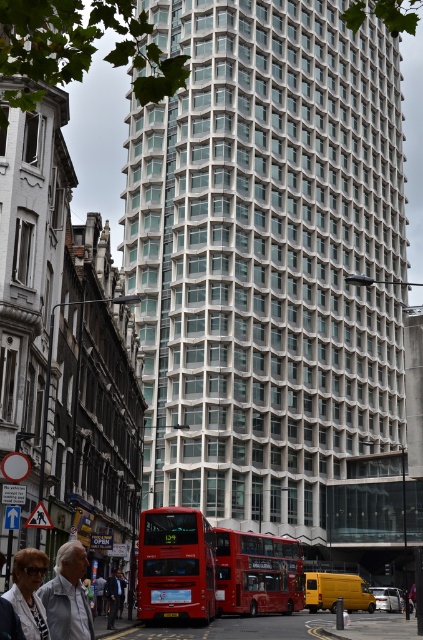
Question: In this image, where is red matte double-decker bus at center located relative to white fabric jacket at lower left?

Choices:
 (A) below
 (B) above

Answer: (A)

Question: Is matte red bus at center wider than white fabric jacket at lower left?

Choices:
 (A) no
 (B) yes

Answer: (B)

Question: Does red matte double-decker bus at center appear on the left side of white fabric jacket at lower left?

Choices:
 (A) yes
 (B) no

Answer: (B)

Question: Which object is farther from the camera taking this photo?

Choices:
 (A) red matte double-decker bus at center
 (B) matte red bus at center
 (C) white fabric jacket at lower left
 (D) matte black jacket at lower left

Answer: (B)

Question: Which object appears farthest from the camera in this image?

Choices:
 (A) matte black jacket at lower left
 (B) red matte double-decker bus at center
 (C) matte red bus at center
 (D) white fabric jacket at lower left

Answer: (C)

Question: Which point appears closest to the camera in this image?

Choices:
 (A) (384, 51)
 (B) (38, 628)

Answer: (B)